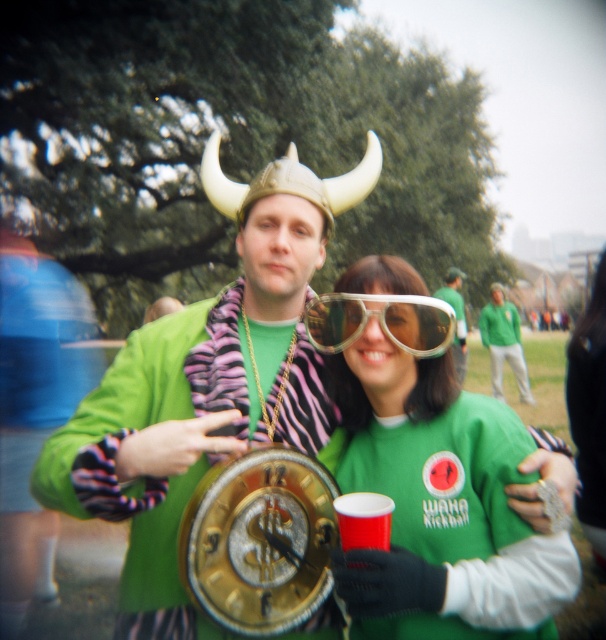
You are a photographer trying to capture a closeup of the clear plastic goggles at center. The green matte shirt at center is blocking your view. Can you adjust your position to get a clear shot without moving the subjects?

The green matte shirt at center is larger than the clear plastic goggles at center, so adjusting your position slightly might allow you to frame the shot around the shirt to capture the goggles without obstruction.

You are a photographer trying to capture a clear shot of both the green matte shirt at center and the gold metallic clock at center. Which object should you focus on first to ensure both are in focus?

The green matte shirt at center is in front of the gold metallic clock at center. To ensure both are in focus, you should focus on the green matte shirt at center first, as it is closer to the camera, and the clock will naturally come into focus behind it.

Based on the photo, you are a photographer trying to capture a closeup shot of the clear plastic goggles at center and the gold metallic clock at center. Since you can only focus on one object at a time, which one should you focus on to ensure the other is still in the frame?

You should focus on the gold metallic clock at center because the clear plastic goggles at center is above it, so focusing on the lower object will keep both in the frame.